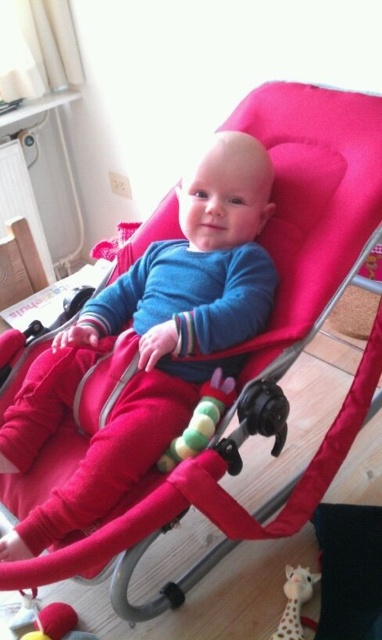
You are a parent checking the toys attached to the baby bouncer. You see the soft plush giraffe at lower center and the soft plush toy at lower left. Which toy is taller?

The soft plush giraffe at lower center is taller than the soft plush toy at lower left.

You are a photographer setting up for a baby photo shoot. The baby is in a bright red bouncer chair, and there is a soft plush giraffe at lower center. To ensure the giraffe is in the perfect spot for the photo, where should you position the camera relative to the baby?

The soft plush giraffe at lower center is located at point (x=294, y=602), so the camera should be positioned slightly to the right and below the baby to capture the giraffe in focus.

You are a parent trying to choose between two toys for your baby. You see the soft plush giraffe at lower center and the soft plush toy at lower left. Which toy is positioned higher in the bouncer?

The soft plush giraffe at lower center is located above the soft plush toy at lower left, so the soft plush giraffe at lower center is positioned higher in the bouncer.